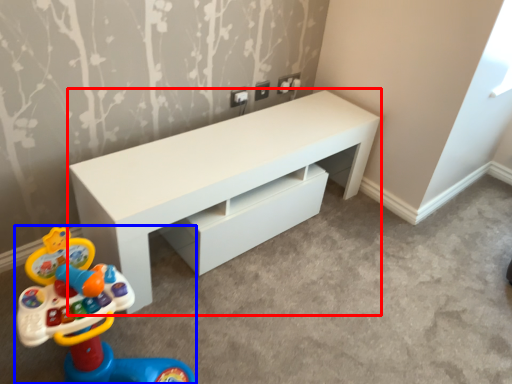
Question: Which point is further to the camera, table (highlighted by a red box) or toy (highlighted by a blue box)?

Choices:
 (A) table
 (B) toy

Answer: (A)